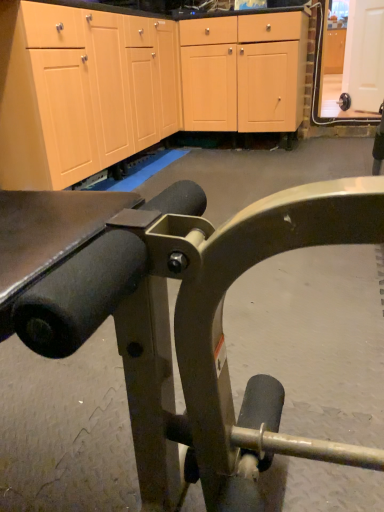
This screenshot has height=512, width=384. What are the coordinates of `matte wood cabinet at upper right, which appears as the second cabinetry when viewed from the front` in the screenshot? It's located at (334, 51).

Describe the element at coordinates (334, 51) in the screenshot. The width and height of the screenshot is (384, 512). I see `matte wood cabinet at upper right, the 2th cabinetry from the bottom` at that location.

Measure the distance between point (326, 48) and camera.

11.38 meters.

This screenshot has width=384, height=512. What do you see at coordinates (244, 72) in the screenshot? I see `light wood/veneer cabinets at center, the first cabinetry positioned from the left` at bounding box center [244, 72].

At what (x,y) coordinates should I click in order to perform the action: click on light wood/veneer cabinets at center, which is the 2th cabinetry from right to left. Please return your answer as a coordinate pair (x, y). The image size is (384, 512). Looking at the image, I should click on (244, 72).

This screenshot has height=512, width=384. Find the location of `matte wood cabinet at upper right, the 1th cabinetry viewed from the back`. matte wood cabinet at upper right, the 1th cabinetry viewed from the back is located at coordinates (334, 51).

Can you confirm if matte wood cabinet at upper right, which ranks as the first cabinetry in top-to-bottom order, is positioned to the right of light wood/veneer cabinets at center, the first cabinetry positioned from the left?

Yes, matte wood cabinet at upper right, which ranks as the first cabinetry in top-to-bottom order, is to the right of light wood/veneer cabinets at center, the first cabinetry positioned from the left.

Between matte wood cabinet at upper right, which ranks as the first cabinetry in top-to-bottom order, and light wood/veneer cabinets at center, the first cabinetry in the bottom-to-top sequence, which one is positioned behind?

matte wood cabinet at upper right, which ranks as the first cabinetry in top-to-bottom order, is behind.

Does point (334, 29) appear closer or farther from the camera than point (205, 32)?

Clearly, point (334, 29) is more distant from the camera than point (205, 32).

From the image's perspective, between matte wood cabinet at upper right, the first cabinetry viewed from the right, and light wood/veneer cabinets at center, arranged as the 1th cabinetry when viewed from the front, which one is located above?

matte wood cabinet at upper right, the first cabinetry viewed from the right, is shown above in the image.

In the scene shown: From a real-world perspective, is matte wood cabinet at upper right, which ranks as the first cabinetry in top-to-bottom order, located higher than light wood/veneer cabinets at center, arranged as the 1th cabinetry when viewed from the front?

Yes, from a real-world perspective, matte wood cabinet at upper right, which ranks as the first cabinetry in top-to-bottom order, is on top of light wood/veneer cabinets at center, arranged as the 1th cabinetry when viewed from the front.

From the picture: Which of these two, matte wood cabinet at upper right, the 1th cabinetry viewed from the back, or light wood/veneer cabinets at center, the 2th cabinetry when ordered from back to front, is wider?

matte wood cabinet at upper right, the 1th cabinetry viewed from the back, is wider.

Between matte wood cabinet at upper right, the first cabinetry viewed from the right, and light wood/veneer cabinets at center, the first cabinetry positioned from the left, which one has less height?

Standing shorter between the two is light wood/veneer cabinets at center, the first cabinetry positioned from the left.

Between matte wood cabinet at upper right, the first cabinetry viewed from the right, and light wood/veneer cabinets at center, the first cabinetry positioned from the left, which one has smaller size?

matte wood cabinet at upper right, the first cabinetry viewed from the right, is smaller.

Is light wood/veneer cabinets at center, arranged as the second cabinetry when viewed from the top, located within matte wood cabinet at upper right, the second cabinetry in the left-to-right sequence?

Actually, light wood/veneer cabinets at center, arranged as the second cabinetry when viewed from the top, is outside matte wood cabinet at upper right, the second cabinetry in the left-to-right sequence.

Would you say matte wood cabinet at upper right, which appears as the second cabinetry when viewed from the front, is a long distance from light wood/veneer cabinets at center, the 2th cabinetry when ordered from back to front?

Absolutely, matte wood cabinet at upper right, which appears as the second cabinetry when viewed from the front, is distant from light wood/veneer cabinets at center, the 2th cabinetry when ordered from back to front.

Could you tell me if matte wood cabinet at upper right, the 2th cabinetry from the bottom, is facing light wood/veneer cabinets at center, arranged as the 1th cabinetry when viewed from the front?

Yes, matte wood cabinet at upper right, the 2th cabinetry from the bottom, faces towards light wood/veneer cabinets at center, arranged as the 1th cabinetry when viewed from the front.

The width and height of the screenshot is (384, 512). Identify the location of cabinetry lying below the matte wood cabinet at upper right, the first cabinetry viewed from the right (from the image's perspective). (244, 72).

Is light wood/veneer cabinets at center, which is the 2th cabinetry from right to left, at the right side of matte wood cabinet at upper right, the second cabinetry in the left-to-right sequence?

No, light wood/veneer cabinets at center, which is the 2th cabinetry from right to left, is not to the right of matte wood cabinet at upper right, the second cabinetry in the left-to-right sequence.

Which is in front, light wood/veneer cabinets at center, which is the 2th cabinetry from right to left, or matte wood cabinet at upper right, the second cabinetry in the left-to-right sequence?

light wood/veneer cabinets at center, which is the 2th cabinetry from right to left, is more forward.

Is point (281, 38) farther from camera compared to point (327, 73)?

No.

From the image's perspective, who appears lower, light wood/veneer cabinets at center, arranged as the 1th cabinetry when viewed from the front, or matte wood cabinet at upper right, the second cabinetry in the left-to-right sequence?

light wood/veneer cabinets at center, arranged as the 1th cabinetry when viewed from the front.

From a real-world perspective, relative to matte wood cabinet at upper right, the 2th cabinetry from the bottom, is light wood/veneer cabinets at center, arranged as the second cabinetry when viewed from the top, vertically above or below?

light wood/veneer cabinets at center, arranged as the second cabinetry when viewed from the top, is situated lower than matte wood cabinet at upper right, the 2th cabinetry from the bottom, in the real world.

Between light wood/veneer cabinets at center, the first cabinetry in the bottom-to-top sequence, and matte wood cabinet at upper right, the second cabinetry in the left-to-right sequence, which one has larger width?

matte wood cabinet at upper right, the second cabinetry in the left-to-right sequence, is wider.

Does light wood/veneer cabinets at center, the 2th cabinetry when ordered from back to front, have a lesser height compared to matte wood cabinet at upper right, which ranks as the first cabinetry in top-to-bottom order?

Yes, light wood/veneer cabinets at center, the 2th cabinetry when ordered from back to front, is shorter than matte wood cabinet at upper right, which ranks as the first cabinetry in top-to-bottom order.

Which of these two, light wood/veneer cabinets at center, the 2th cabinetry when ordered from back to front, or matte wood cabinet at upper right, which ranks as the first cabinetry in top-to-bottom order, is smaller?

With smaller size is matte wood cabinet at upper right, which ranks as the first cabinetry in top-to-bottom order.

Which is correct: light wood/veneer cabinets at center, the 2th cabinetry when ordered from back to front, is inside matte wood cabinet at upper right, the 1th cabinetry viewed from the back, or outside of it?

light wood/veneer cabinets at center, the 2th cabinetry when ordered from back to front, is spatially situated outside matte wood cabinet at upper right, the 1th cabinetry viewed from the back.

Can you see light wood/veneer cabinets at center, arranged as the second cabinetry when viewed from the top, touching matte wood cabinet at upper right, which appears as the second cabinetry when viewed from the front?

light wood/veneer cabinets at center, arranged as the second cabinetry when viewed from the top, is not next to matte wood cabinet at upper right, which appears as the second cabinetry when viewed from the front, and they're not touching.

In the scene shown: Could you tell me if light wood/veneer cabinets at center, arranged as the second cabinetry when viewed from the top, is facing matte wood cabinet at upper right, which ranks as the first cabinetry in top-to-bottom order?

No, light wood/veneer cabinets at center, arranged as the second cabinetry when viewed from the top, is not oriented towards matte wood cabinet at upper right, which ranks as the first cabinetry in top-to-bottom order.

How far apart are light wood/veneer cabinets at center, arranged as the second cabinetry when viewed from the top, and matte wood cabinet at upper right, the first cabinetry viewed from the right?

31.70 feet.

This screenshot has height=512, width=384. In order to click on cabinetry above the light wood/veneer cabinets at center, which is the 2th cabinetry from right to left (from the image's perspective) in this screenshot , I will do `click(334, 51)`.

Identify the location of cabinetry that is above the light wood/veneer cabinets at center, the first cabinetry positioned from the left (from the image's perspective). Image resolution: width=384 pixels, height=512 pixels. (334, 51).

In the image, there is a matte wood cabinet at upper right, which ranks as the first cabinetry in top-to-bottom order. Identify the location of cabinetry below it (from a real-world perspective). (244, 72).